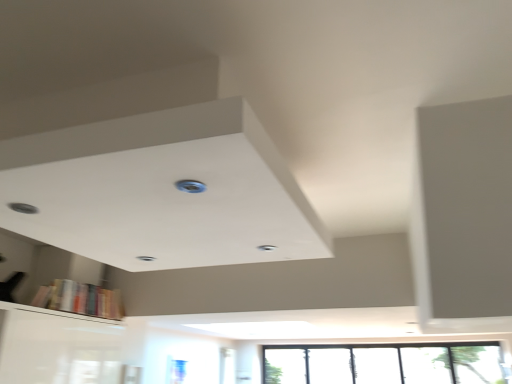
Question: Is transparent glass window at lower right at the right side of hardcover books at lower left?

Choices:
 (A) no
 (B) yes

Answer: (B)

Question: Can you confirm if transparent glass window at lower right is taller than hardcover books at lower left?

Choices:
 (A) yes
 (B) no

Answer: (A)

Question: Can you confirm if transparent glass window at lower right is positioned to the left of hardcover books at lower left?

Choices:
 (A) no
 (B) yes

Answer: (A)

Question: Can you confirm if transparent glass window at lower right is shorter than hardcover books at lower left?

Choices:
 (A) yes
 (B) no

Answer: (B)

Question: Does transparent glass window at lower right have a larger size compared to hardcover books at lower left?

Choices:
 (A) yes
 (B) no

Answer: (A)

Question: Is hardcover books at lower left in front of or behind transparent glass window at lower right in the image?

Choices:
 (A) behind
 (B) front

Answer: (B)

Question: Is hardcover books at lower left inside the boundaries of transparent glass window at lower right, or outside?

Choices:
 (A) inside
 (B) outside

Answer: (B)

Question: From a real-world perspective, is hardcover books at lower left positioned above or below transparent glass window at lower right?

Choices:
 (A) below
 (B) above

Answer: (B)

Question: Considering the positions of point pyautogui.click(x=60, y=301) and point pyautogui.click(x=349, y=362), is point pyautogui.click(x=60, y=301) closer or farther from the camera than point pyautogui.click(x=349, y=362)?

Choices:
 (A) closer
 (B) farther

Answer: (A)

Question: Considering the positions of transparent glass window at lower right and blue plastic hole at center in the image, is transparent glass window at lower right wider or thinner than blue plastic hole at center?

Choices:
 (A) thin
 (B) wide

Answer: (A)

Question: Is transparent glass window at lower right situated inside blue plastic hole at center or outside?

Choices:
 (A) outside
 (B) inside

Answer: (A)

Question: Considering the relative positions of transparent glass window at lower right and blue plastic hole at center in the image provided, is transparent glass window at lower right to the left or to the right of blue plastic hole at center?

Choices:
 (A) left
 (B) right

Answer: (B)

Question: From the image's perspective, relative to blue plastic hole at center, is transparent glass window at lower right above or below?

Choices:
 (A) below
 (B) above

Answer: (A)

Question: From a real-world perspective, is blue plastic hole at center physically located above or below transparent glass window at lower right?

Choices:
 (A) below
 (B) above

Answer: (B)

Question: Considering the positions of point (183, 185) and point (386, 352), is point (183, 185) closer or farther from the camera than point (386, 352)?

Choices:
 (A) closer
 (B) farther

Answer: (A)